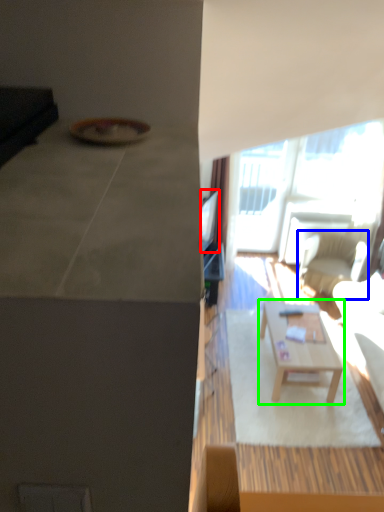
Question: Considering the real-world distances, which object is closest to television (highlighted by a red box)? chair (highlighted by a blue box) or coffee table (highlighted by a green box).

Choices:
 (A) chair
 (B) coffee table

Answer: (B)